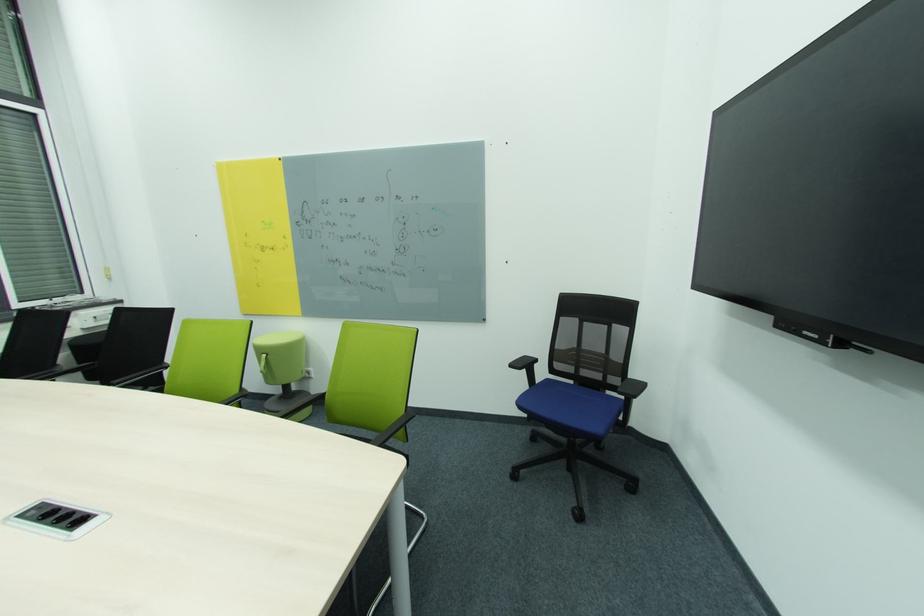
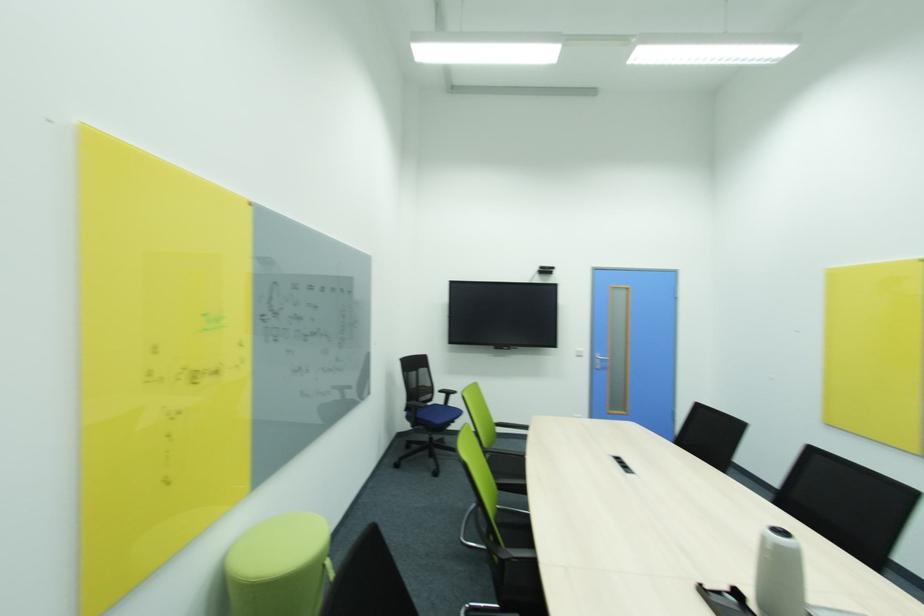
The point at (624,331) is marked in the first image. Where is the corresponding point in the second image?

(428, 371)